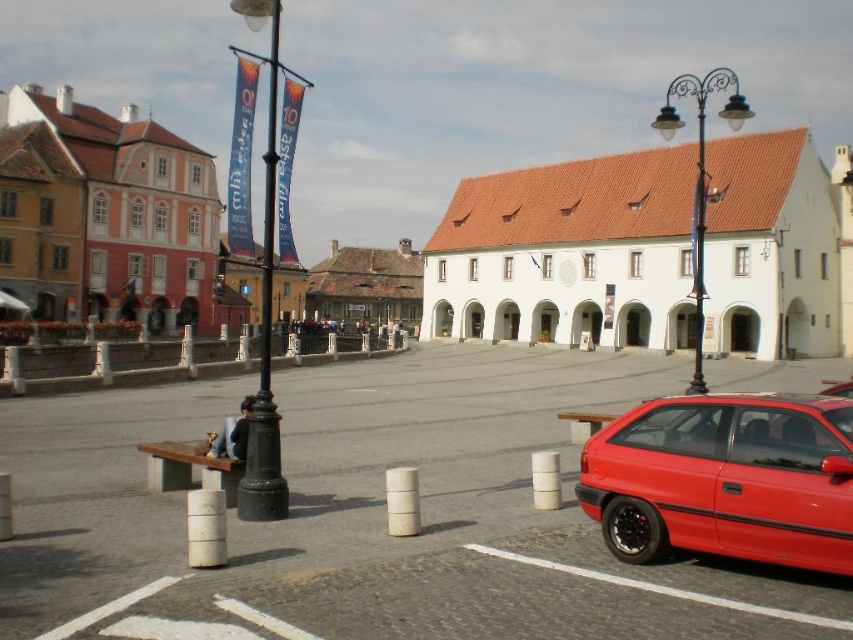
Question: Which of the following is the farthest from the observer?

Choices:
 (A) black metal pole at center
 (B) white concrete parking lot at center

Answer: (A)

Question: Does white matte building at center have a lesser width compared to black metal pole at center?

Choices:
 (A) no
 (B) yes

Answer: (A)

Question: Which object is closer to the camera taking this photo?

Choices:
 (A) shiny red sedan at lower right
 (B) black wrought iron streetlight at upper right
 (C) black metal pole at center

Answer: (A)

Question: Can you confirm if white matte building at center is positioned below black metal pole at left?

Choices:
 (A) yes
 (B) no

Answer: (A)

Question: Is white matte building at center closer to the viewer compared to shiny red sedan at lower right?

Choices:
 (A) no
 (B) yes

Answer: (A)

Question: Which object is the farthest from the black metal pole at left?

Choices:
 (A) white matte building at center
 (B) black metal pole at center

Answer: (B)